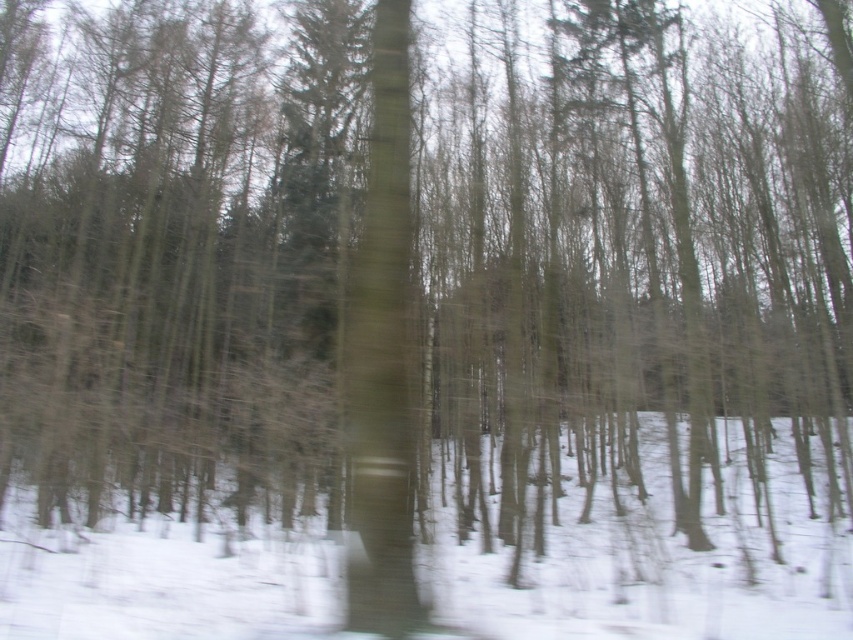
Question: Which point is farther to the camera?

Choices:
 (A) (393, 438)
 (B) (498, 612)

Answer: (B)

Question: Is white powdery snow at center to the right of smooth bark tree trunk at center from the viewer's perspective?

Choices:
 (A) yes
 (B) no

Answer: (A)

Question: Considering the relative positions of white powdery snow at center and smooth bark tree trunk at center in the image provided, where is white powdery snow at center located with respect to smooth bark tree trunk at center?

Choices:
 (A) below
 (B) above

Answer: (A)

Question: Is white powdery snow at center below smooth bark tree trunk at center?

Choices:
 (A) no
 (B) yes

Answer: (B)

Question: Among these points, which one is farthest from the camera?

Choices:
 (A) click(689, 554)
 (B) click(399, 512)

Answer: (A)